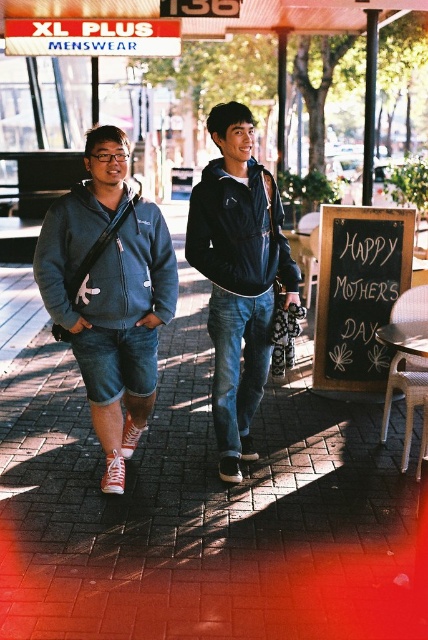
Which is below, matte blue hoodie at center or matte blue sweatshirt at left?

Positioned lower is matte blue hoodie at center.

Between point (118, 438) and point (62, 284), which one is positioned behind?

Positioned behind is point (118, 438).

Image resolution: width=428 pixels, height=640 pixels. In order to click on matte blue hoodie at center in this screenshot , I will do `click(109, 292)`.

Measure the distance between point (142, 273) and camera.

They are 3.64 meters apart.

Between matte blue hoodie at center and dark blue fleece sweatshirt at center, which one has less height?

With less height is dark blue fleece sweatshirt at center.

Is point (104, 241) farther from viewer compared to point (258, 168)?

No.

You are a GUI agent. You are given a task and a screenshot of the screen. Output one action in this format:
    pyautogui.click(x=<x>, y=<y>)
    Task: Click on the matte blue hoodie at center
    This screenshot has height=640, width=428.
    Given the screenshot: What is the action you would take?
    pyautogui.click(x=109, y=292)

Can you confirm if brick pavement at center is thinner than matte blue sweatshirt at left?

No.

Does brick pavement at center have a greater height compared to matte blue sweatshirt at left?

Indeed, brick pavement at center has a greater height compared to matte blue sweatshirt at left.

This screenshot has height=640, width=428. I want to click on brick pavement at center, so click(x=199, y=509).

The height and width of the screenshot is (640, 428). In order to click on brick pavement at center in this screenshot , I will do `click(199, 509)`.